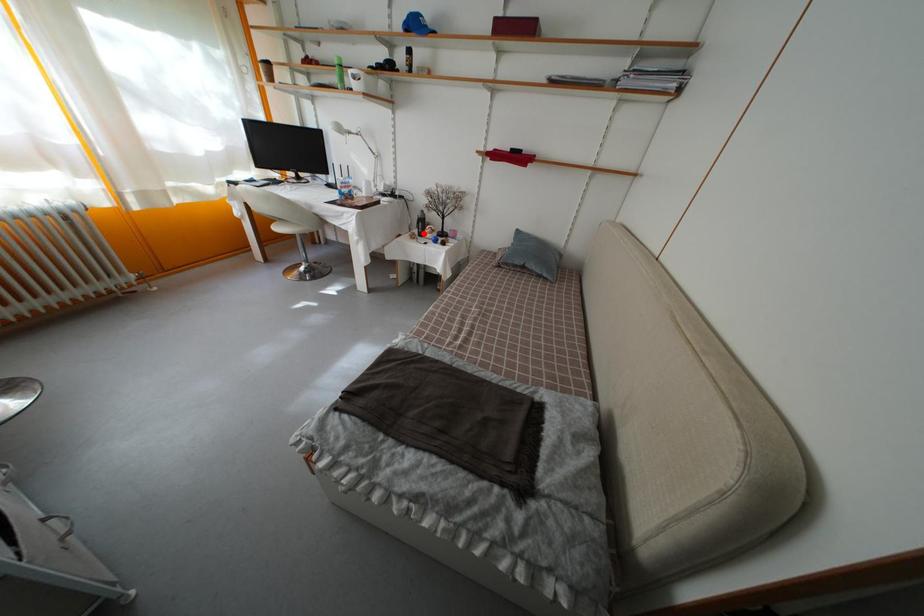
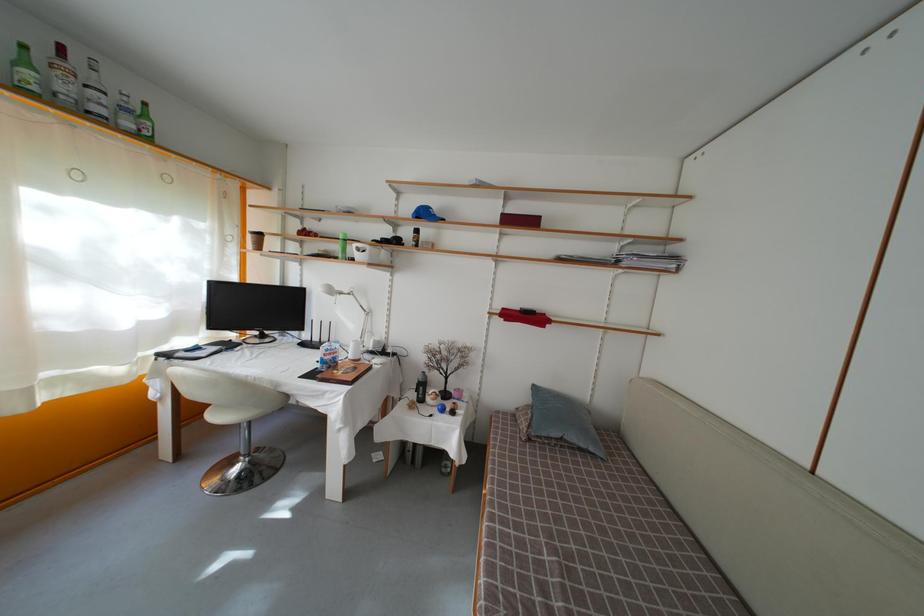
Find the pixel in the second image that matches the highlighted location in the first image.

(422, 397)